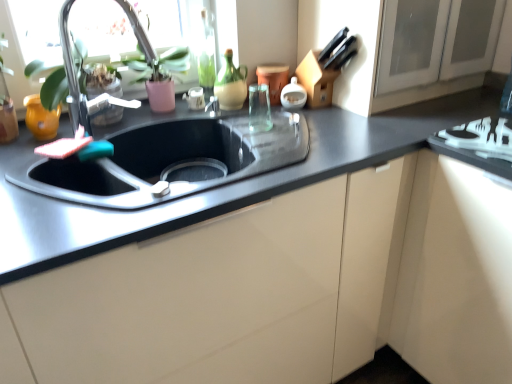
Where is `vacant region in front of white glossy soap dispenser at upper center, acting as the 1th appliance starting from the right`? The height and width of the screenshot is (384, 512). vacant region in front of white glossy soap dispenser at upper center, acting as the 1th appliance starting from the right is located at coordinates (312, 124).